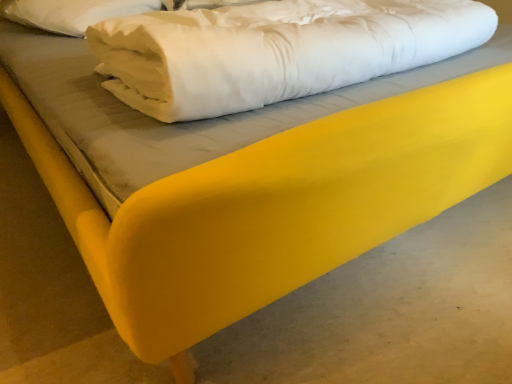
Question: Considering the positions of white soft pillow at upper left and white soft fabric at center in the image, is white soft pillow at upper left wider or thinner than white soft fabric at center?

Choices:
 (A) wide
 (B) thin

Answer: (B)

Question: From the image's perspective, is white soft pillow at upper left located above or below white soft fabric at center?

Choices:
 (A) above
 (B) below

Answer: (A)

Question: Based on their sizes in the image, would you say white soft pillow at upper left is bigger or smaller than white soft fabric at center?

Choices:
 (A) big
 (B) small

Answer: (B)

Question: Is point (244, 39) positioned closer to the camera than point (64, 6)?

Choices:
 (A) farther
 (B) closer

Answer: (B)

Question: In terms of height, does white soft fabric at center look taller or shorter compared to white soft pillow at upper left?

Choices:
 (A) tall
 (B) short

Answer: (A)

Question: Would you say white soft fabric at center is to the left or to the right of white soft pillow at upper left in the picture?

Choices:
 (A) left
 (B) right

Answer: (B)

Question: Based on their sizes in the image, would you say white soft fabric at center is bigger or smaller than white soft pillow at upper left?

Choices:
 (A) big
 (B) small

Answer: (A)